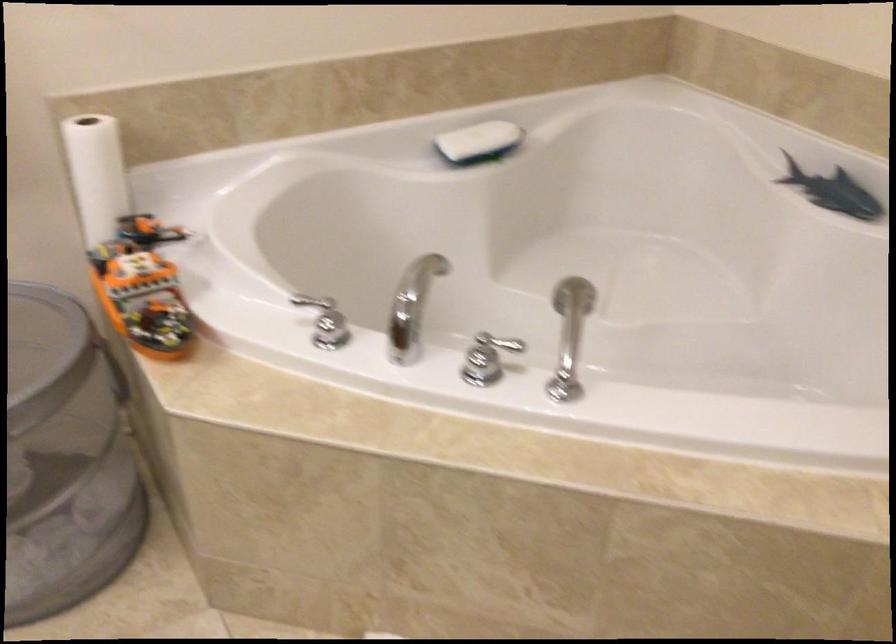
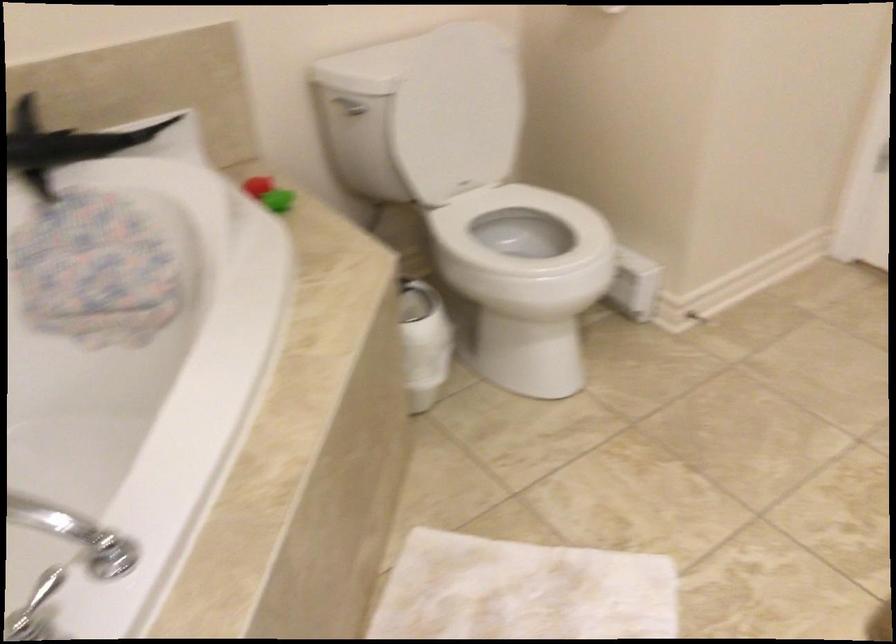
First-person continuous shooting, in which direction is the camera rotating?

The camera rotated toward right-down.